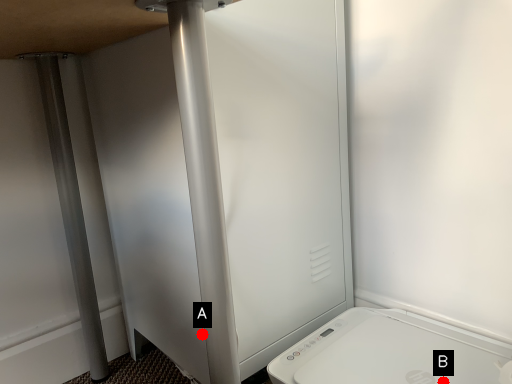
Question: Two points are circled on the image, labeled by A and B beside each circle. Which point appears farthest from the camera in this image?

Choices:
 (A) A is further
 (B) B is further

Answer: (A)